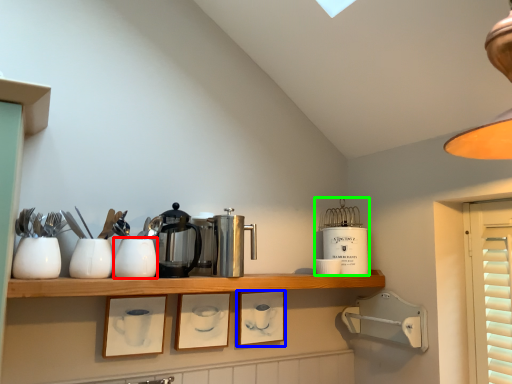
Question: Based on their relative distances, which object is farther from tableware (highlighted by a red box)? Choose from picture frame (highlighted by a blue box) and appliance (highlighted by a green box).

Choices:
 (A) picture frame
 (B) appliance

Answer: (B)